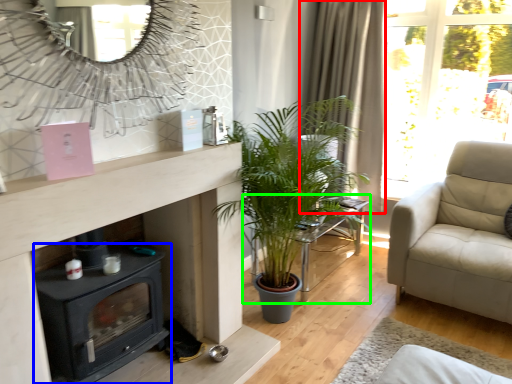
Question: Which is nearer to the curtain (highlighted by a red box)? wood burning stove (highlighted by a blue box) or table (highlighted by a green box).

Choices:
 (A) wood burning stove
 (B) table

Answer: (B)